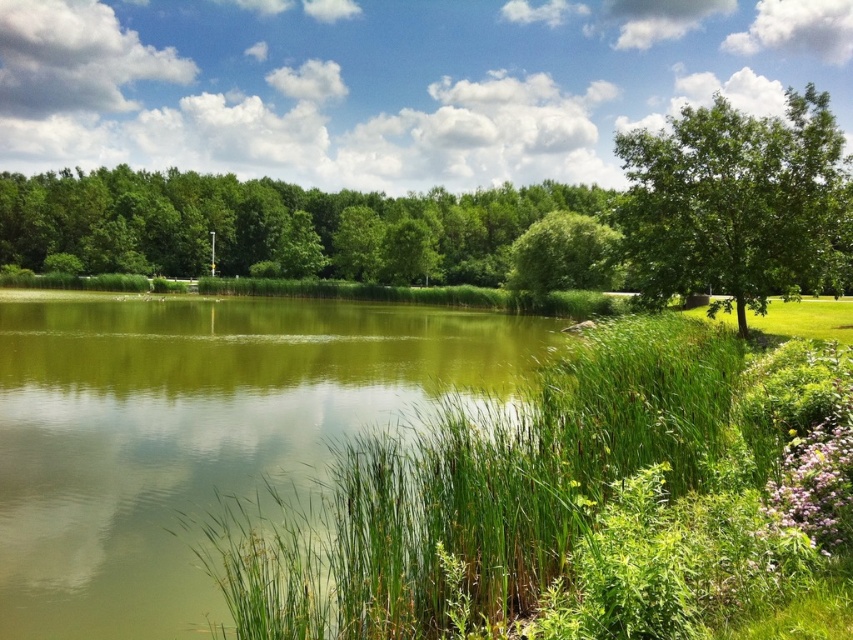
You are an environmental scientist observing the landscape. You need to determine which object is smaller between the green grass at center and the green leafy tree at upper center. Which one is it?

The green grass at center is smaller compared to the green leafy tree at upper center.

You are an environmental scientist studying the spatial distribution of trees in the image. You observe the green leafy tree at upper center and the green leafy tree at center. Which tree has a wider spread of branches?

The green leafy tree at upper center has a wider spread of branches than the green leafy tree at center.